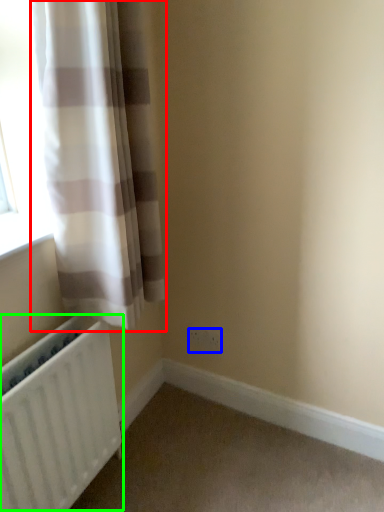
Question: Estimate the real-world distances between objects in this image. Which object is closer to curtain (highlighted by a red box), electric outlet (highlighted by a blue box) or radiator (highlighted by a green box)?

Choices:
 (A) electric outlet
 (B) radiator

Answer: (B)